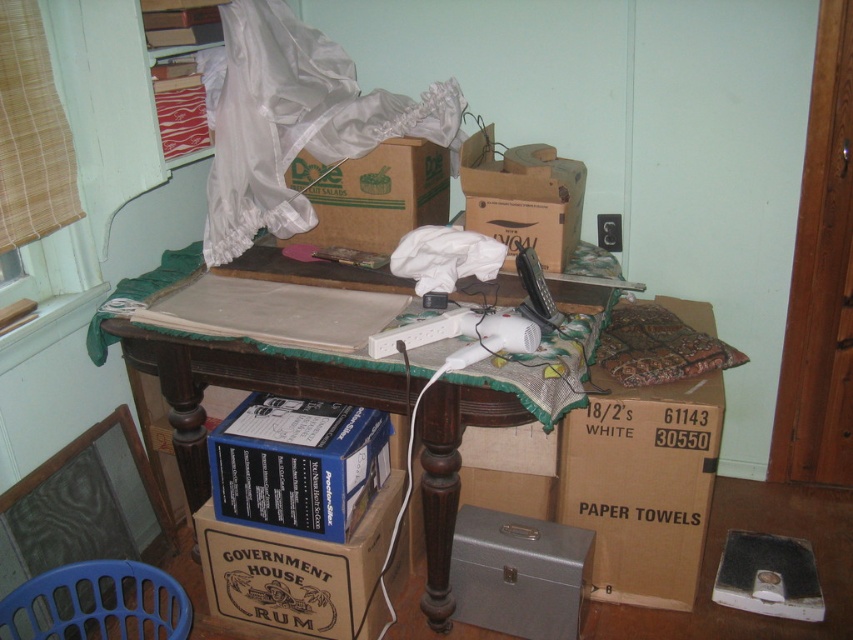
Between point (241, 464) and point (523, 579), which one is positioned behind?

The point (523, 579) is behind.

Does blue cardboard box at lower center have a lesser width compared to metallic gray toolbox at lower center?

In fact, blue cardboard box at lower center might be wider than metallic gray toolbox at lower center.

Who is more distant from viewer, (322, 449) or (503, 602)?

Point (503, 602)

I want to click on blue cardboard box at lower center, so click(297, 465).

Is metallic gray toolbox at lower center further to the viewer compared to brown cardboard box at upper center?

No, it is not.

Is point (477, 625) more distant than point (291, 173)?

No, (477, 625) is closer to viewer.

Which is behind, point (474, 595) or point (389, 160)?

The point (389, 160) is more distant.

You are a GUI agent. You are given a task and a screenshot of the screen. Output one action in this format:
    pyautogui.click(x=<x>, y=<y>)
    Task: Click on the metallic gray toolbox at lower center
    The image size is (853, 640).
    Given the screenshot: What is the action you would take?
    pyautogui.click(x=519, y=573)

Does point (405, 550) lie in front of point (467, 154)?

No.

Where is `brown cardboard box at lower center`? This screenshot has height=640, width=853. brown cardboard box at lower center is located at coordinates (299, 573).